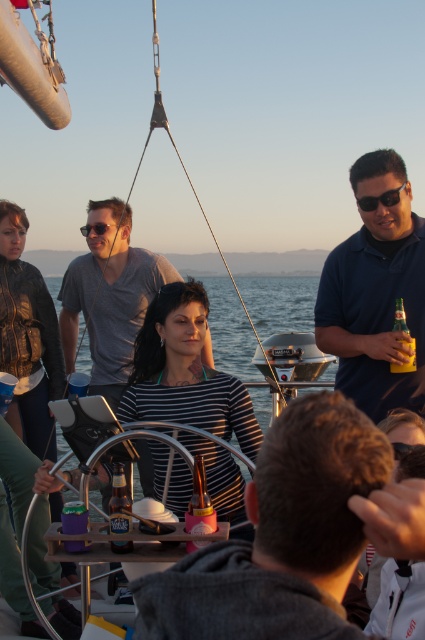
Measure the distance between dark blue shirt at right and matte gray shirt at center.

9.12 feet

At what (x,y) coordinates should I click in order to perform the action: click on dark blue shirt at right. Please return your answer as a coordinate pair (x, y). This screenshot has height=640, width=425. Looking at the image, I should click on (376, 291).

This screenshot has width=425, height=640. In order to click on dark blue shirt at right in this screenshot , I will do `click(376, 291)`.

How much distance is there between translucent glass bottle at center and matte black sunglasses at upper left?

The distance of translucent glass bottle at center from matte black sunglasses at upper left is 5.11 meters.

Who is more forward, [113,531] or [95,227]?

Point [113,531]

Where is `translucent glass bottle at center`? translucent glass bottle at center is located at coordinates (119, 502).

Is translucent glass bottle at center positioned behind black plastic sunglasses at right?

No, it is in front of black plastic sunglasses at right.

Is translucent glass bottle at center shorter than black plastic sunglasses at right?

In fact, translucent glass bottle at center may be taller than black plastic sunglasses at right.

What do you see at coordinates (119, 502) in the screenshot?
I see `translucent glass bottle at center` at bounding box center [119, 502].

What are the coordinates of `translucent glass bottle at center` in the screenshot? It's located at (119, 502).